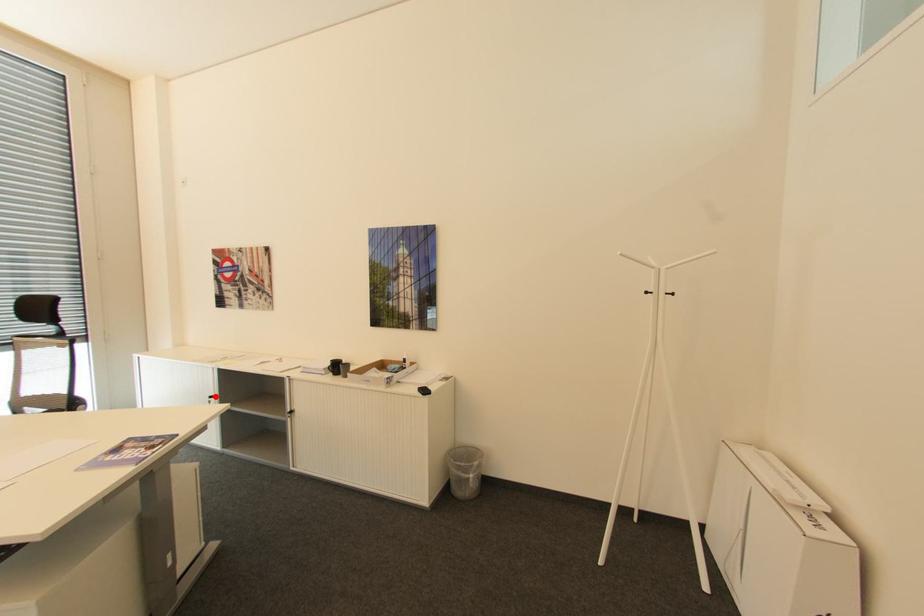
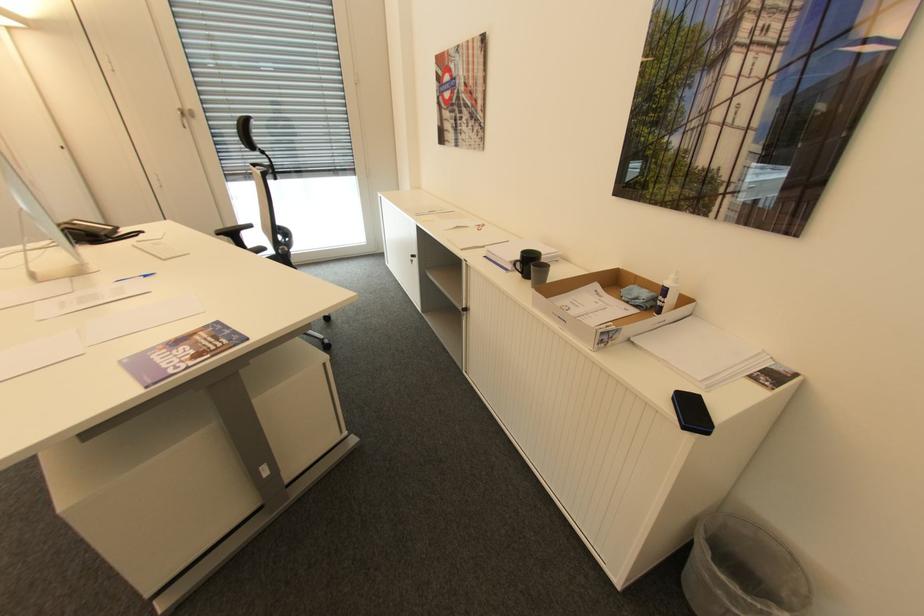
In the second image, find the point that corresponds to the highlighted location in the first image.

(418, 256)